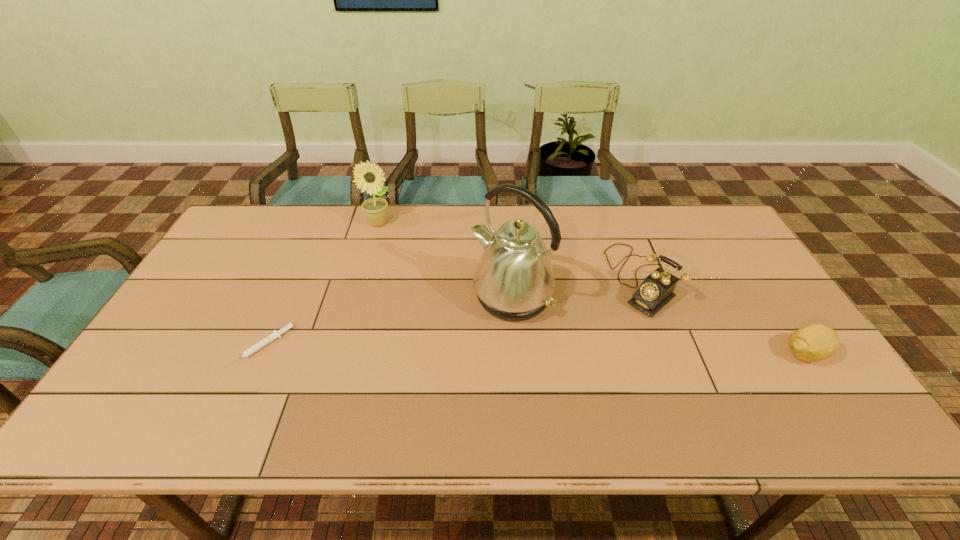
You are a GUI agent. You are given a task and a screenshot of the screen. Output one action in this format:
    pyautogui.click(x=<x>, y=<y>)
    Task: Click on the syringe
    The width and height of the screenshot is (960, 540).
    Given the screenshot: What is the action you would take?
    pyautogui.click(x=275, y=334)

Where is `the leftmost object`? The height and width of the screenshot is (540, 960). the leftmost object is located at coordinates point(275,334).

Identify the location of the rightmost object. This screenshot has height=540, width=960. (816, 342).

Where is `the fourth tallest object`? The image size is (960, 540). the fourth tallest object is located at coordinates (816, 342).

Find the location of `the second tallest object`. the second tallest object is located at coordinates (369, 176).

Locate an element on the screen. The height and width of the screenshot is (540, 960). the farthest object is located at coordinates (369, 176).

Image resolution: width=960 pixels, height=540 pixels. In order to click on telephone in this screenshot , I will do `click(656, 290)`.

Image resolution: width=960 pixels, height=540 pixels. What are the coordinates of `the second object from right to left` in the screenshot? It's located at (656, 290).

Where is `kettle`? The height and width of the screenshot is (540, 960). kettle is located at coordinates (514, 280).

Locate an element on the screen. This screenshot has height=540, width=960. the third object from right to left is located at coordinates (514, 280).